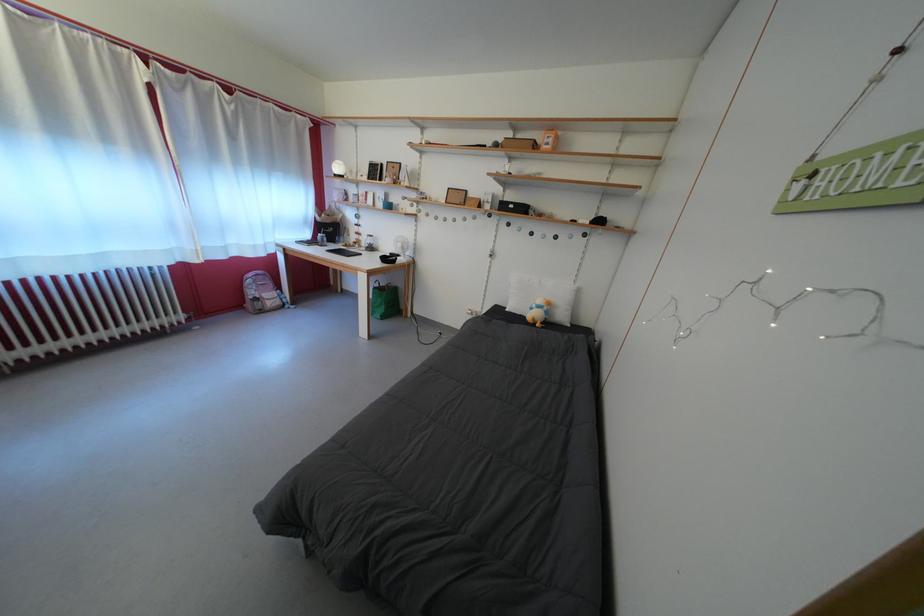
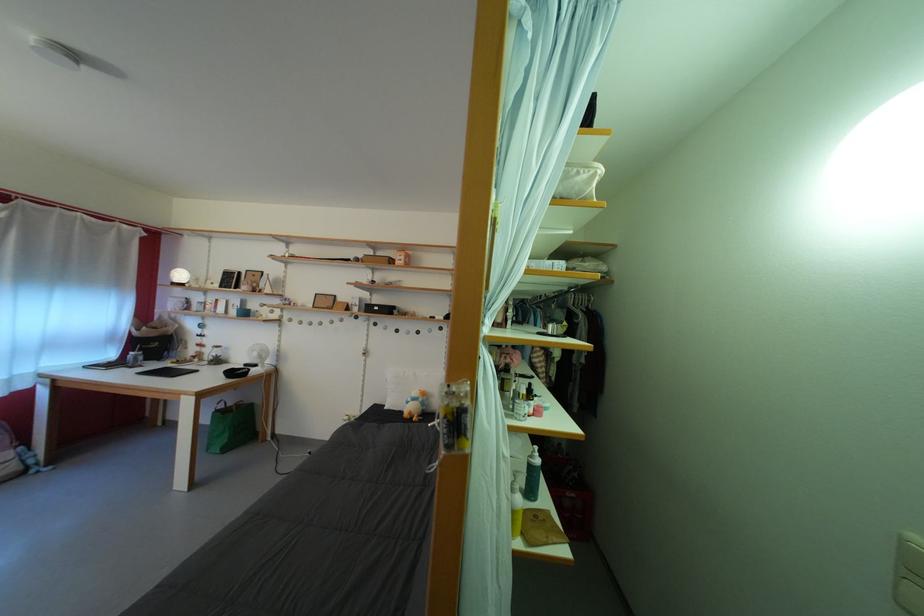
Locate, in the second image, the point that corresponds to [519,213] in the first image.

(384, 314)